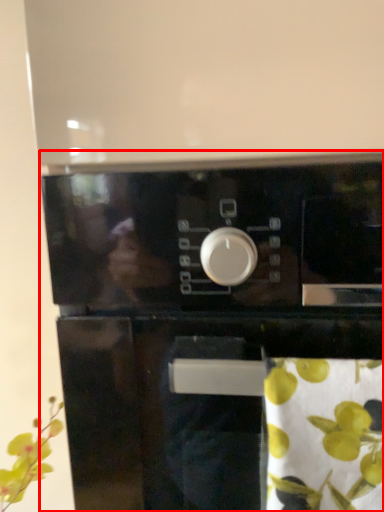
Question: Where is home appliance (annotated by the red box) located in relation to flower in the image?

Choices:
 (A) left
 (B) right

Answer: (A)